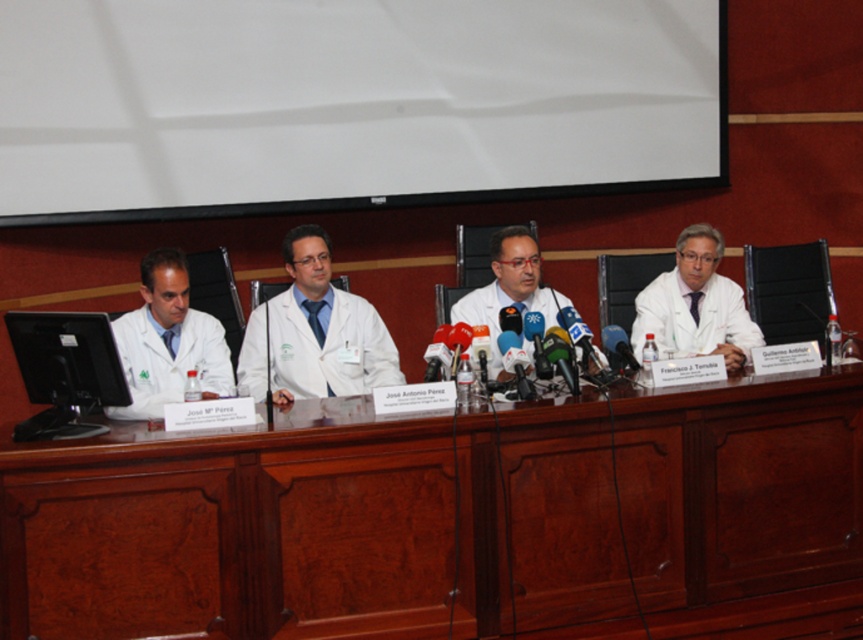
Question: Does white lab coat at right appear over white lab coat at center?

Choices:
 (A) no
 (B) yes

Answer: (A)

Question: Can you confirm if white matte lab coat at center is smaller than black glossy monitor at left?

Choices:
 (A) yes
 (B) no

Answer: (B)

Question: Does white matte projection screen at upper center appear on the left side of white lab coat at left?

Choices:
 (A) yes
 (B) no

Answer: (B)

Question: Which object is farther from the camera taking this photo?

Choices:
 (A) white lab coat at center
 (B) white matte projection screen at upper center

Answer: (B)

Question: Which point is closer to the camera?

Choices:
 (A) brown wood table at center
 (B) white lab coat at center

Answer: (A)

Question: Which point is farther to the camera?

Choices:
 (A) white lab coat at right
 (B) white lab coat at left

Answer: (A)